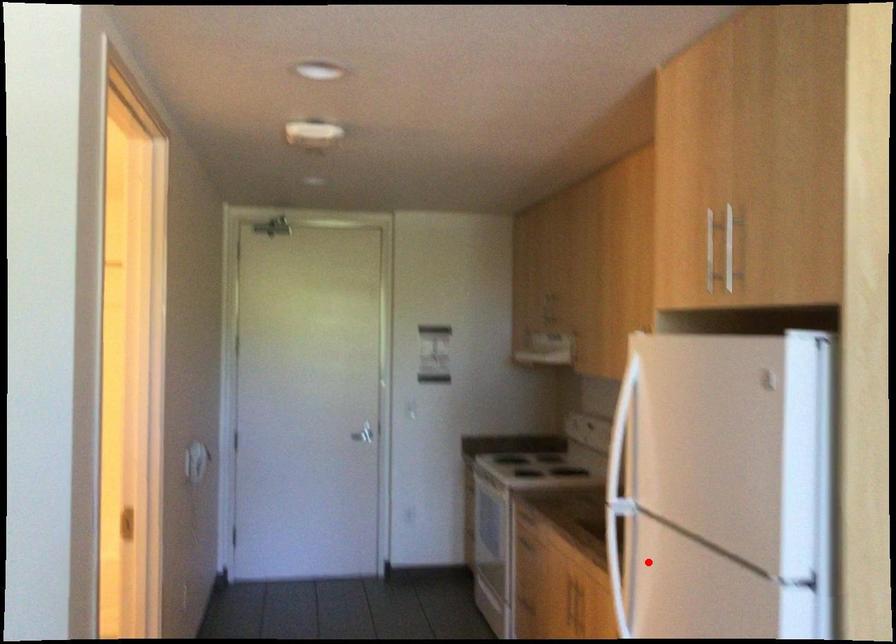
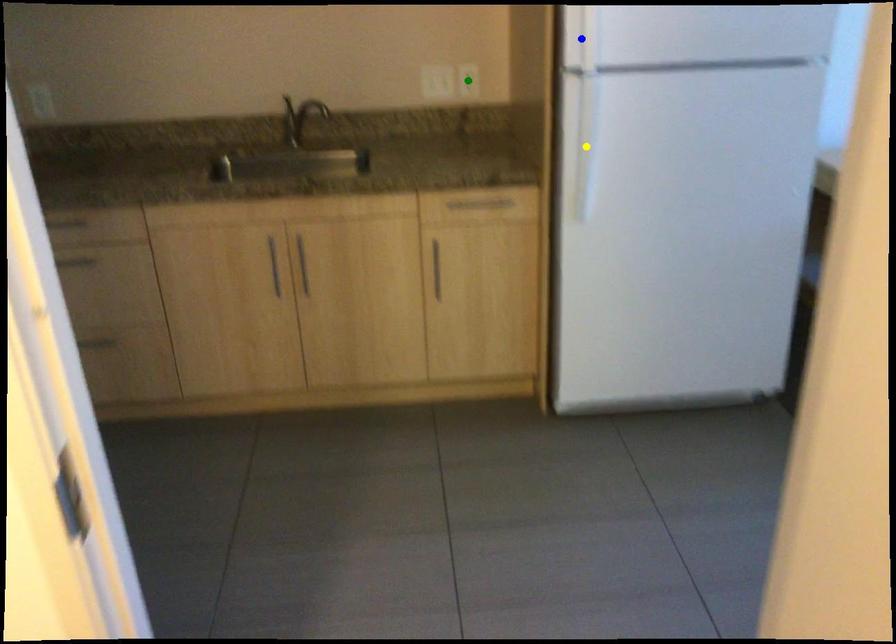
Question: I am providing you with two images of the same scene from different viewpoints. A red point is marked on the first image. You are given multiple points on the second image. Which point in image 2 represents the same 3d spot as the red point in image 1?

Choices:
 (A) green point
 (B) blue point
 (C) yellow point

Answer: (C)